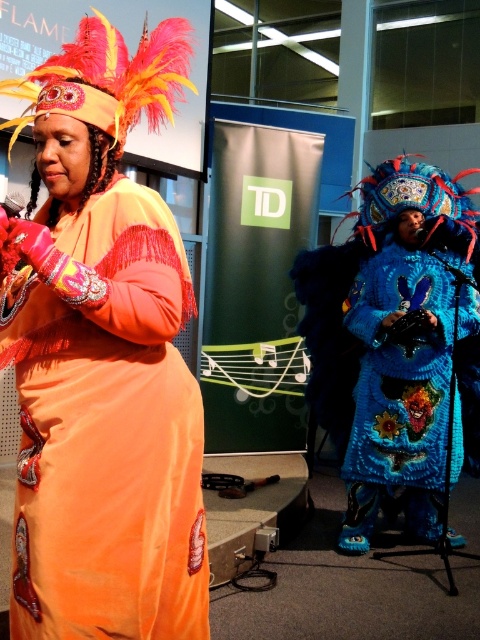
You are sitting in the audience watching the performance. You notice two points on the stage. The first point is at coordinates point [140,547] and the second is at point [433,300]. Which point is closer to you?

Point [140,547] is closer to the viewer than point [433,300].

You are a photographer at the back of the stage. You want to capture both the velvet orange dress at center and the blue knitted robe at center in a single photo. Which performer should you position closer to the front to ensure both are fully visible?

Since the velvet orange dress at center is smaller in size compared to the blue knitted robe at center, you should position the velvet orange dress at center closer to the front. This will help ensure both performers are fully visible in the photo.